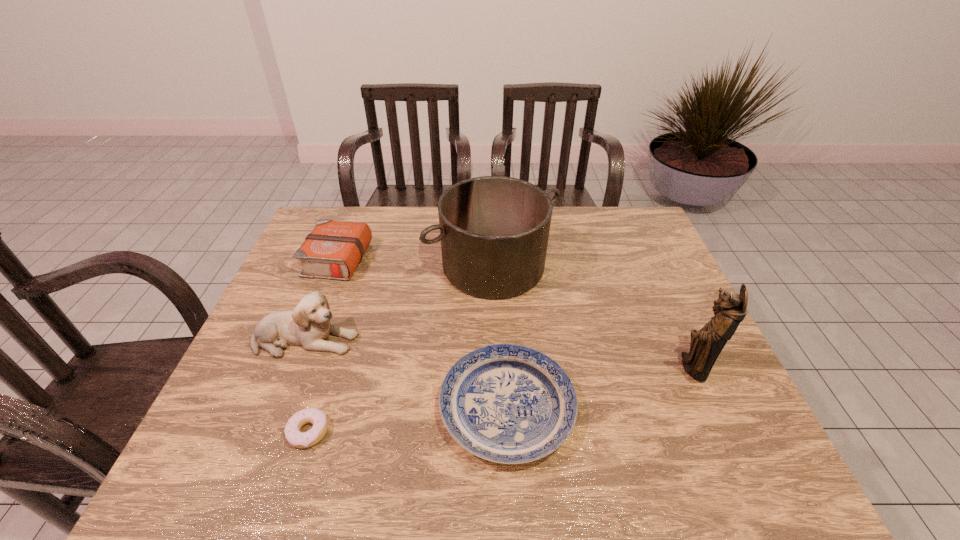
You are a GUI agent. You are given a task and a screenshot of the screen. Output one action in this format:
    pyautogui.click(x=<x>, y=<y>)
    Task: Click on the Bible at the left edge
    The image size is (960, 540).
    Given the screenshot: What is the action you would take?
    pyautogui.click(x=333, y=250)

Locate an element on the screen. object that is at the right edge is located at coordinates (730, 309).

Find the location of `object present at the far left corner`. object present at the far left corner is located at coordinates (333, 250).

This screenshot has width=960, height=540. Find the location of `vacant space at the far edge of the desktop`. vacant space at the far edge of the desktop is located at coordinates (400, 218).

Identify the location of free point at the near edge. coord(313,462).

Locate an element on the screen. free space at the left edge of the desktop is located at coordinates (250, 372).

The width and height of the screenshot is (960, 540). I want to click on vacant position at the right edge of the desktop, so click(739, 421).

The image size is (960, 540). In the image, there is a desktop. Find the location of `vacant space at the near left corner`. vacant space at the near left corner is located at coordinates (207, 471).

Find the location of a particular element. The image size is (960, 540). blank area at the far right corner is located at coordinates (641, 233).

Where is `vacant point located between the fifth tallest object and the fourth shortest object`? The image size is (960, 540). vacant point located between the fifth tallest object and the fourth shortest object is located at coordinates (406, 374).